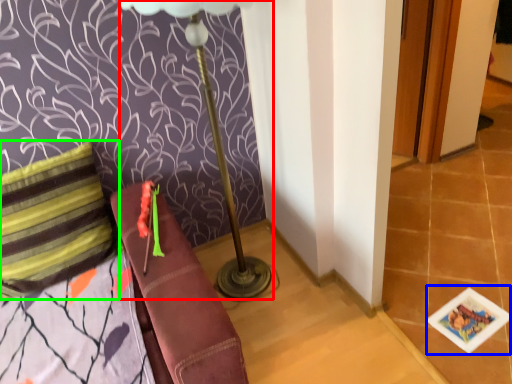
Question: Which is nearer to the table lamp (highlighted by a red box)? card game (highlighted by a blue box) or pillow (highlighted by a green box).

Choices:
 (A) card game
 (B) pillow

Answer: (B)